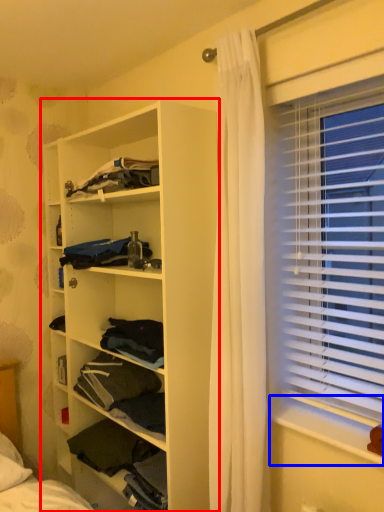
Question: Which object is closer to the camera taking this photo, shelf (highlighted by a red box) or window sill (highlighted by a blue box)?

Choices:
 (A) shelf
 (B) window sill

Answer: (B)